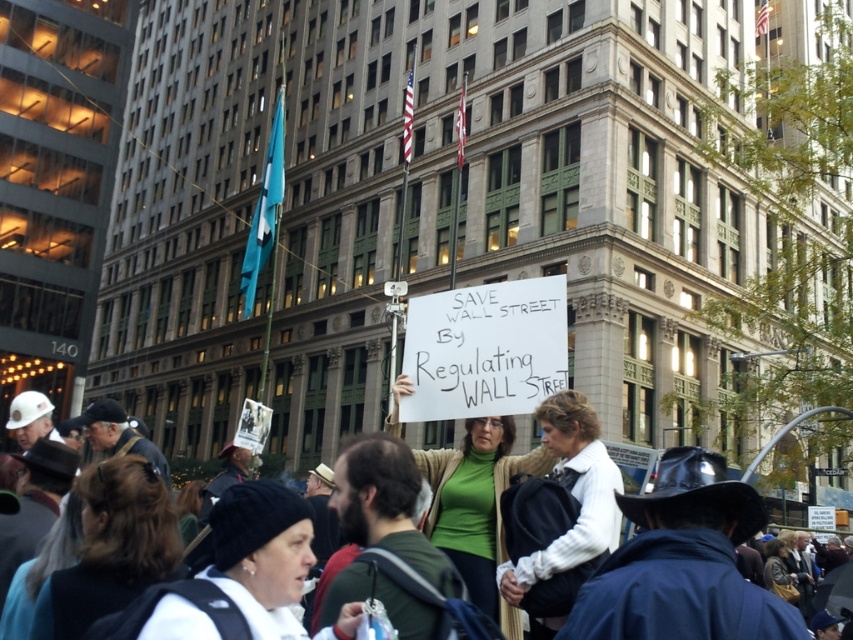
You are a photographer trying to capture a photo of the protest scene. You notice two key elements in the frame, the dark brown hair at lower left and the white matte jacket at center. Which of these two elements would appear wider in your photo?

The dark brown hair at lower left appears wider in the photo because its width is larger than that of the white matte jacket at center.

You are a photographer standing at the edge of the protest scene. You want to take a photo that includes both the white fleece jacket at lower left and the green jersey at center. Which object should you focus on first to ensure both are in the frame?

The white fleece jacket at lower left is smaller than the green jersey at center, so you should focus on the green jersey at center first to ensure both are in the frame.

You are a photographer standing at the edge of the protest scene. You want to take a photo that includes both the white matte jacket at center and the green sweater at center. Given that your camera has a maximum focus range of 70 feet, will you be able to capture both subjects in focus without moving your position?

The distance between the white matte jacket at center and the green sweater at center is 72.47 feet. Since your camera can only focus up to 70 feet, you won t be able to capture both subjects in focus without moving closer or adjusting your position.